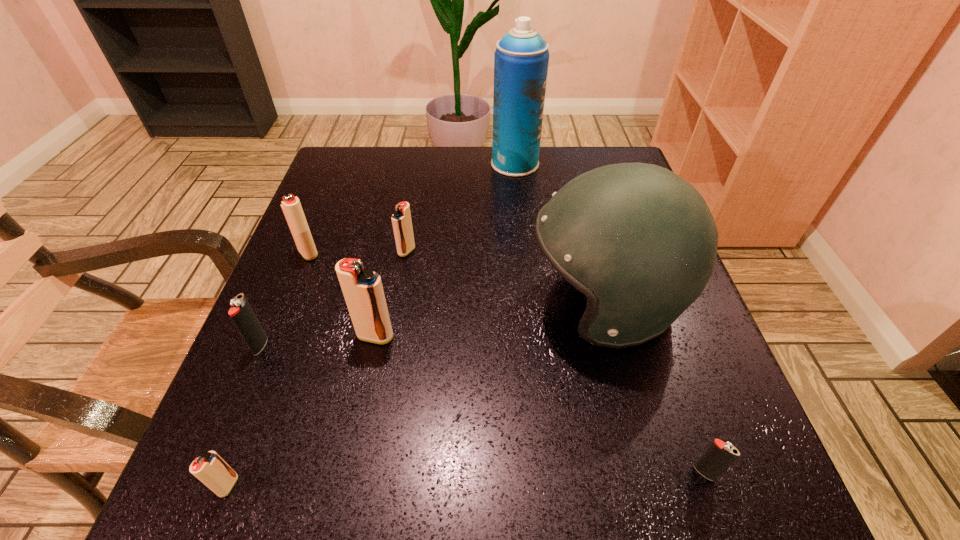
The height and width of the screenshot is (540, 960). Identify the location of free location that satisfies the following two spatial constraints: 1. on the front side of the smaller black igniter; 2. on the right side of the tallest igniter. (348, 472).

Where is `free spot that satisfies the following two spatial constraints: 1. on the back side of the second biggest red igniter; 2. on the right side of the aerosol can`? Image resolution: width=960 pixels, height=540 pixels. free spot that satisfies the following two spatial constraints: 1. on the back side of the second biggest red igniter; 2. on the right side of the aerosol can is located at coordinates (344, 164).